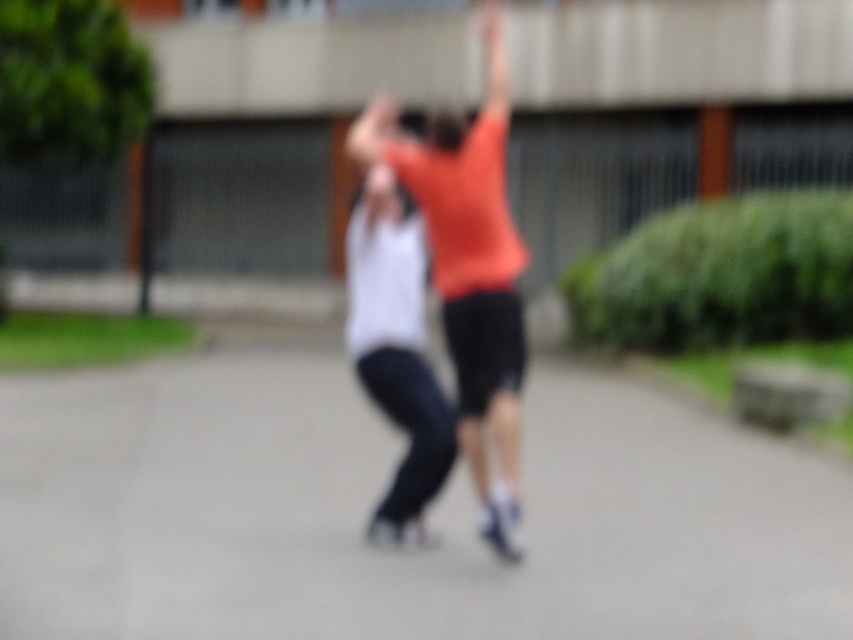
Question: Which point is farther to the camera?

Choices:
 (A) (488, 256)
 (B) (416, 404)

Answer: (B)

Question: Can you confirm if gray asphalt pavement at center is positioned to the left of orange cotton shirt at center?

Choices:
 (A) yes
 (B) no

Answer: (A)

Question: Which of the following is the closest to the observer?

Choices:
 (A) (372, 304)
 (B) (489, 257)

Answer: (B)

Question: Can you confirm if gray asphalt pavement at center is positioned below orange cotton shirt at center?

Choices:
 (A) no
 (B) yes

Answer: (B)

Question: Which point is farther to the camera?

Choices:
 (A) white matte tank top at center
 (B) gray asphalt pavement at center

Answer: (A)

Question: Can you confirm if gray asphalt pavement at center is positioned above white matte tank top at center?

Choices:
 (A) no
 (B) yes

Answer: (A)